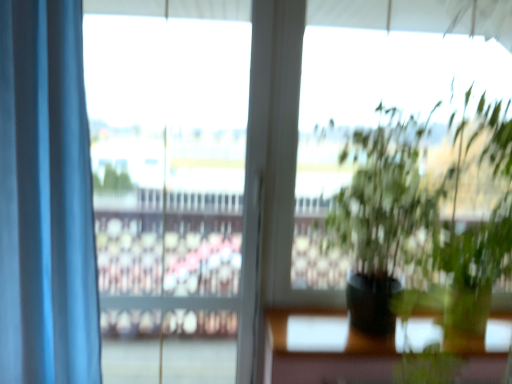
Question: Is clear glass window at center aimed at blue fabric curtain at left?

Choices:
 (A) no
 (B) yes

Answer: (B)

Question: Are clear glass window at center and blue fabric curtain at left far apart?

Choices:
 (A) yes
 (B) no

Answer: (A)

Question: Is clear glass window at center bigger than blue fabric curtain at left?

Choices:
 (A) no
 (B) yes

Answer: (A)

Question: Is clear glass window at center positioned before blue fabric curtain at left?

Choices:
 (A) yes
 (B) no

Answer: (B)

Question: Would you say clear glass window at center contains blue fabric curtain at left?

Choices:
 (A) no
 (B) yes

Answer: (A)

Question: Considering the relative sizes of clear glass window at center and blue fabric curtain at left in the image provided, is clear glass window at center shorter than blue fabric curtain at left?

Choices:
 (A) yes
 (B) no

Answer: (B)

Question: Can you confirm if blue fabric curtain at left is taller than clear glass window at center?

Choices:
 (A) yes
 (B) no

Answer: (B)

Question: Is blue fabric curtain at left to the right of clear glass window at center from the viewer's perspective?

Choices:
 (A) yes
 (B) no

Answer: (B)

Question: Is blue fabric curtain at left not within clear glass window at center?

Choices:
 (A) no
 (B) yes

Answer: (B)

Question: Does blue fabric curtain at left lie in front of clear glass window at center?

Choices:
 (A) yes
 (B) no

Answer: (A)

Question: From a real-world perspective, is blue fabric curtain at left beneath clear glass window at center?

Choices:
 (A) no
 (B) yes

Answer: (A)

Question: From a real-world perspective, is blue fabric curtain at left on clear glass window at center?

Choices:
 (A) no
 (B) yes

Answer: (B)

Question: Would you say blue fabric curtain at left is inside or outside clear glass window at center?

Choices:
 (A) outside
 (B) inside

Answer: (A)